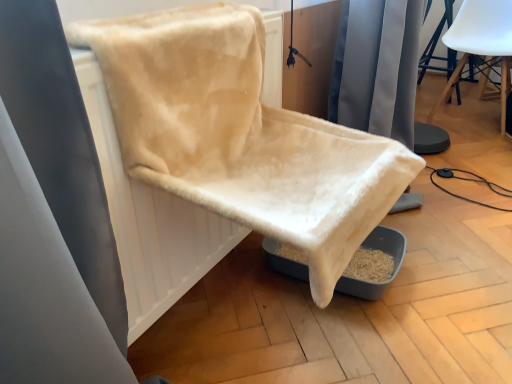
This screenshot has width=512, height=384. Identify the location of beige plush chair at center, which is counted as the second chair, starting from the right. (240, 134).

Considering the relative sizes of white matte chair at upper right, acting as the first chair starting from the back, and beige fabric radiator at center in the image provided, is white matte chair at upper right, acting as the first chair starting from the back, shorter than beige fabric radiator at center?

No.

Is white matte chair at upper right, acting as the first chair starting from the back, placed right next to beige fabric radiator at center?

There is a gap between white matte chair at upper right, acting as the first chair starting from the back, and beige fabric radiator at center.

Is white matte chair at upper right, which ranks as the 2th chair in left-to-right order, wider or thinner than beige fabric radiator at center?

In the image, white matte chair at upper right, which ranks as the 2th chair in left-to-right order, appears to be wider than beige fabric radiator at center.

Relative to beige plush chair at center, which is counted as the second chair, starting from the right, is beige fabric radiator at center in front or behind?

beige fabric radiator at center is behind beige plush chair at center, which is counted as the second chair, starting from the right.

The height and width of the screenshot is (384, 512). Find the location of `radiator below the beige plush chair at center, the 1th chair when ordered from bottom to top (from the image's perspective)`. radiator below the beige plush chair at center, the 1th chair when ordered from bottom to top (from the image's perspective) is located at coordinates (150, 220).

Is beige fabric radiator at center facing away from beige plush chair at center, the first chair viewed from the front?

Yes.

Which object is wider, beige fabric radiator at center or white matte chair at upper right, the 2th chair ordered from the bottom?

Wider between the two is white matte chair at upper right, the 2th chair ordered from the bottom.

Is beige fabric radiator at center far from white matte chair at upper right, acting as the first chair starting from the back?

Yes, beige fabric radiator at center is far from white matte chair at upper right, acting as the first chair starting from the back.

Is the position of beige plush chair at center, the first chair viewed from the front, more distant than that of beige fabric radiator at center?

No, beige plush chair at center, the first chair viewed from the front, is in front of beige fabric radiator at center.

The width and height of the screenshot is (512, 384). Identify the location of radiator that is below the beige plush chair at center, the 1th chair when ordered from bottom to top (from the image's perspective). (150, 220).

Is beige plush chair at center, which ranks as the 2th chair in top-to-bottom order, facing away from beige fabric radiator at center?

Yes, beige plush chair at center, which ranks as the 2th chair in top-to-bottom order,'s orientation is away from beige fabric radiator at center.

Is beige plush chair at center, the first chair viewed from the front, at the back of white matte chair at upper right, acting as the first chair starting from the back?

No, white matte chair at upper right, acting as the first chair starting from the back,'s orientation is not away from beige plush chair at center, the first chair viewed from the front.

Which is closer to the camera, (506, 78) or (230, 30)?

The point (230, 30) is closer to the camera.

Is the position of white matte chair at upper right, which is the 1th chair in right-to-left order, less distant than that of beige plush chair at center, which is the second chair in back-to-front order?

No, white matte chair at upper right, which is the 1th chair in right-to-left order, is further to the viewer.

From a real-world perspective, is white matte chair at upper right, acting as the first chair starting from the back, above or below beige plush chair at center, which is counted as the second chair, starting from the right?

From a real-world perspective, white matte chair at upper right, acting as the first chair starting from the back, is physically below beige plush chair at center, which is counted as the second chair, starting from the right.

Which object is closer to the camera taking this photo, beige plush chair at center, which is the second chair in back-to-front order, or white matte chair at upper right, acting as the first chair starting from the back?

beige plush chair at center, which is the second chair in back-to-front order, is more forward.

From the image's perspective, would you say beige plush chair at center, the 1th chair when ordered from bottom to top, is shown under white matte chair at upper right, which is counted as the second chair, starting from the front?

Indeed, from the image's perspective, beige plush chair at center, the 1th chair when ordered from bottom to top, is shown beneath white matte chair at upper right, which is counted as the second chair, starting from the front.

Looking at this image, can you confirm if beige plush chair at center, which is the second chair in back-to-front order, is taller than white matte chair at upper right, acting as the first chair starting from the back?

No.

Is beige plush chair at center, which is the second chair in back-to-front order, looking in the opposite direction of white matte chair at upper right, acting as the first chair starting from the back?

No.

Identify the location of radiator on the left of white matte chair at upper right, acting as the first chair starting from the back. The height and width of the screenshot is (384, 512). (150, 220).

This screenshot has width=512, height=384. In order to click on radiator located underneath the beige plush chair at center, the first chair viewed from the front (from a real-world perspective) in this screenshot , I will do pos(150,220).

From the picture: Considering their positions, is beige fabric radiator at center positioned closer to beige plush chair at center, the 1th chair in the left-to-right sequence, than white matte chair at upper right, the 2th chair ordered from the bottom?

Among the two, beige fabric radiator at center is located nearer to beige plush chair at center, the 1th chair in the left-to-right sequence.

Considering their positions, is beige plush chair at center, which ranks as the 2th chair in top-to-bottom order, positioned closer to white matte chair at upper right, arranged as the 1th chair when viewed from the top, than beige fabric radiator at center?

beige plush chair at center, which ranks as the 2th chair in top-to-bottom order, lies closer to white matte chair at upper right, arranged as the 1th chair when viewed from the top, than the other object.

Considering their positions, is white matte chair at upper right, the 2th chair ordered from the bottom, positioned further to beige plush chair at center, the first chair viewed from the front, than beige fabric radiator at center?

white matte chair at upper right, the 2th chair ordered from the bottom, is further to beige plush chair at center, the first chair viewed from the front.

Based on their spatial positions, is white matte chair at upper right, acting as the first chair starting from the back, or beige plush chair at center, which is the second chair in back-to-front order, closer to beige fabric radiator at center?

Among the two, beige plush chair at center, which is the second chair in back-to-front order, is located nearer to beige fabric radiator at center.

From the image, which object appears to be farther from white matte chair at upper right, which is counted as the second chair, starting from the front, beige fabric radiator at center or beige plush chair at center, which is counted as the second chair, starting from the right?

The object further to white matte chair at upper right, which is counted as the second chair, starting from the front, is beige fabric radiator at center.

Looking at the image, which one is located closer to beige fabric radiator at center, beige plush chair at center, the 1th chair in the left-to-right sequence, or white matte chair at upper right, arranged as the 1th chair when viewed from the top?

beige plush chair at center, the 1th chair in the left-to-right sequence, is closer to beige fabric radiator at center.

What are the coordinates of `radiator between beige plush chair at center, the 1th chair when ordered from bottom to top, and white matte chair at upper right, which is the 1th chair in right-to-left order, from front to back` in the screenshot? It's located at (150, 220).